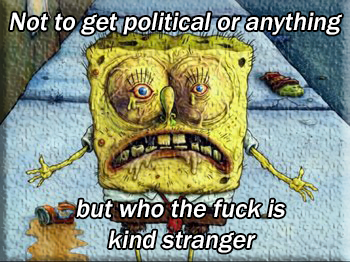
The image size is (350, 262). Identify the location of cup. (278, 78).